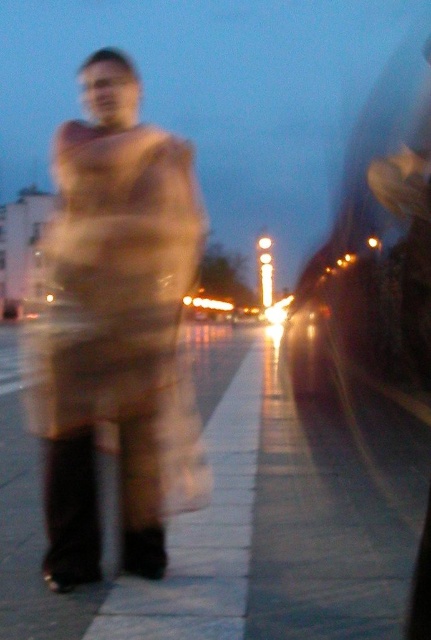
Is beige wool coat at center to the left of smooth concrete sidewalk at center from the viewer's perspective?

Indeed, beige wool coat at center is positioned on the left side of smooth concrete sidewalk at center.

Between point (159, 564) and point (15, 618), which one is positioned behind?

The point (159, 564) is more distant.

Identify the location of beige wool coat at center. The height and width of the screenshot is (640, 431). (115, 330).